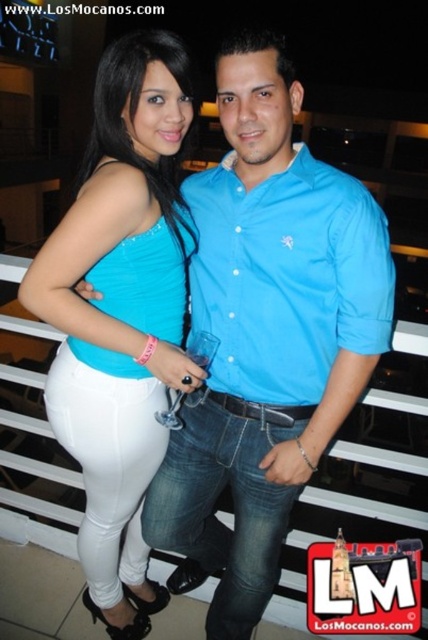
Is matte blue shirt at center smaller than matte blue tank top at center?

Actually, matte blue shirt at center might be larger than matte blue tank top at center.

Is point (192, 481) farther from viewer compared to point (23, 301)?

Yes, it is behind point (23, 301).

Identify the location of matte blue shirt at center. (267, 332).

Does matte blue shirt at center have a greater height compared to matte blue button-up shirt at center?

Yes.

Is matte blue shirt at center positioned before matte blue button-up shirt at center?

No, matte blue shirt at center is further to the viewer.

Locate an element on the screen. The image size is (428, 640). matte blue shirt at center is located at coordinates (267, 332).

Is matte blue tank top at center to the left of matte blue button-up shirt at center from the viewer's perspective?

Correct, you'll find matte blue tank top at center to the left of matte blue button-up shirt at center.

In the scene shown: Can you confirm if matte blue tank top at center is taller than matte blue button-up shirt at center?

Yes.

The height and width of the screenshot is (640, 428). Identify the location of matte blue tank top at center. (121, 314).

Image resolution: width=428 pixels, height=640 pixels. I want to click on matte blue tank top at center, so click(121, 314).